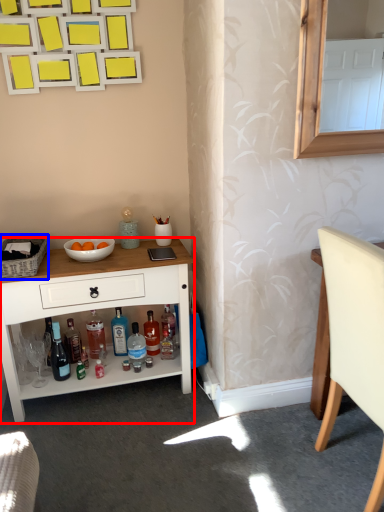
Question: Which point is closer to the camera, desk (highlighted by a red box) or picnic basket (highlighted by a blue box)?

Choices:
 (A) desk
 (B) picnic basket

Answer: (B)